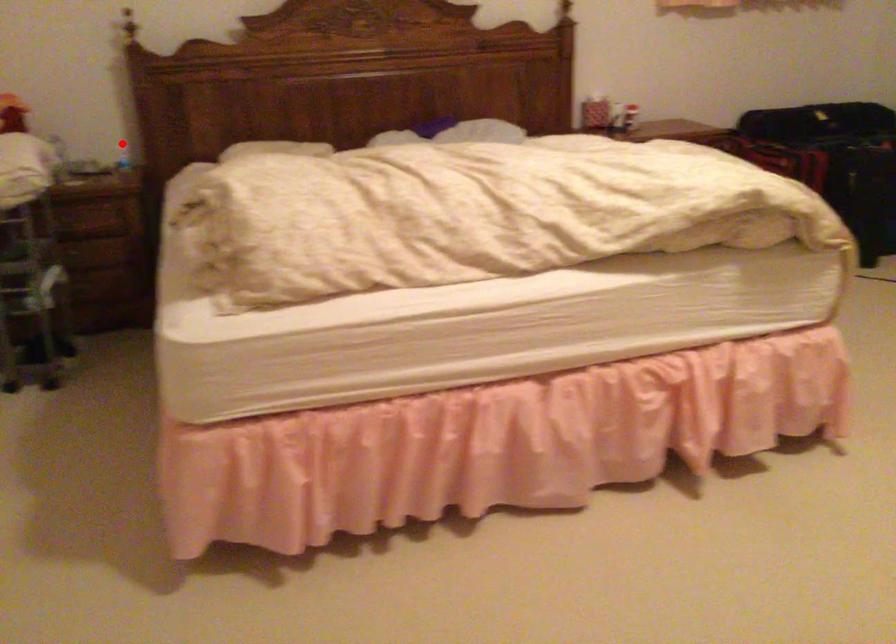
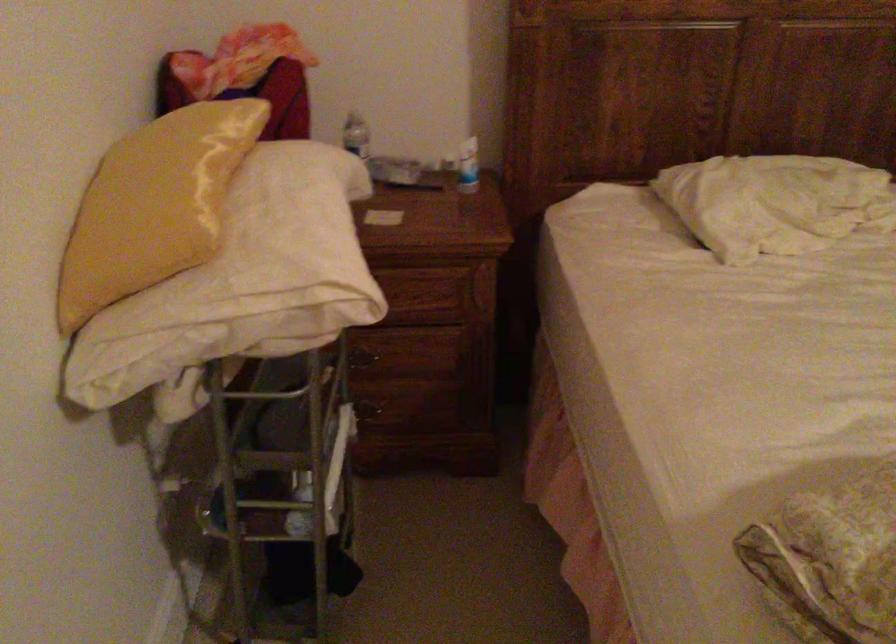
The point at the highlighted location is marked in the first image. Where is the corresponding point in the second image?

(468, 166)